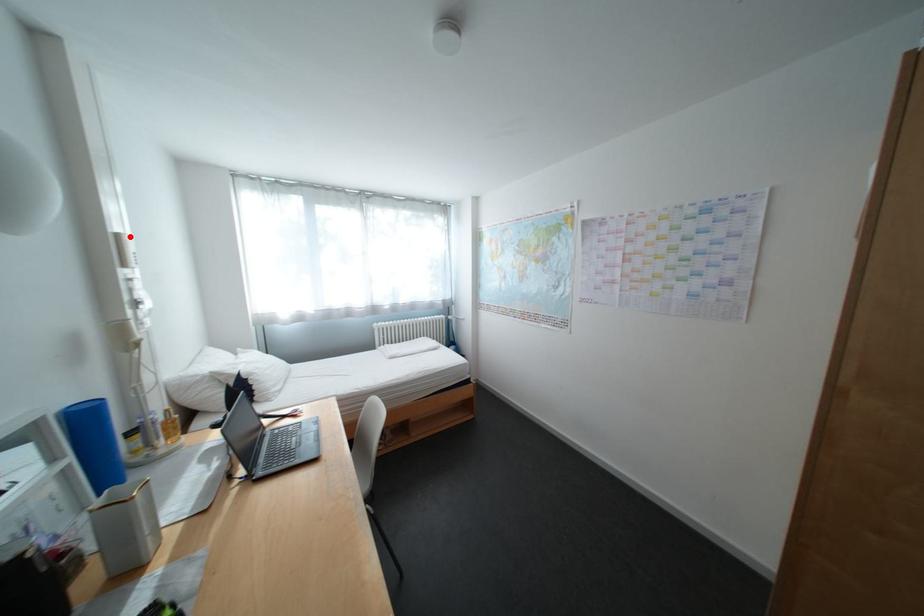
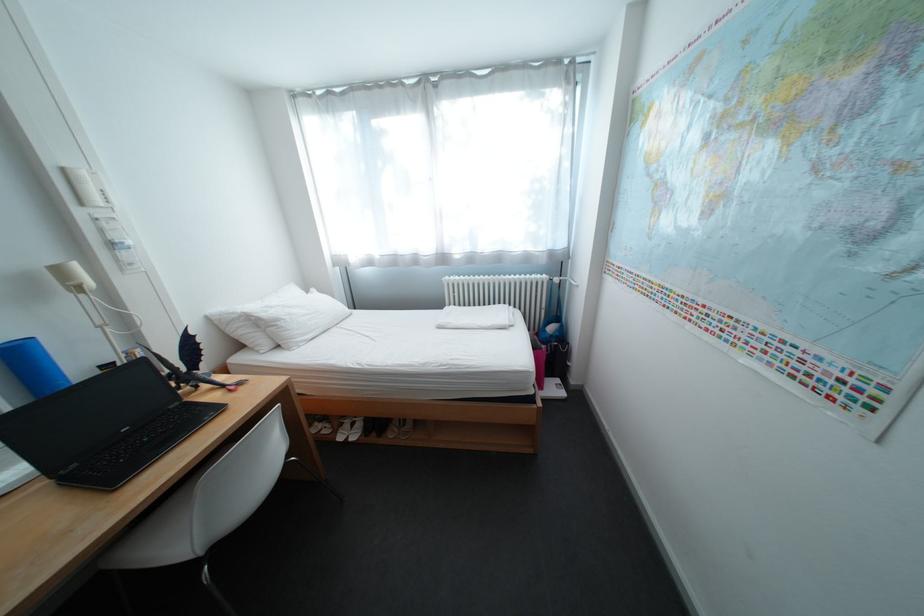
Locate, in the second image, the point that corresponds to the highlighted location in the first image.

(76, 171)